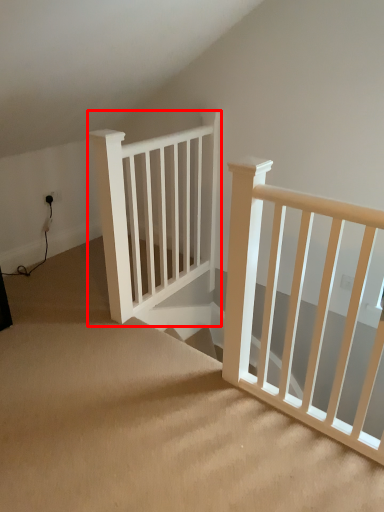
Question: Observing the image, what is the correct spatial positioning of rail (annotated by the red box) in reference to stairs?

Choices:
 (A) left
 (B) right

Answer: (B)